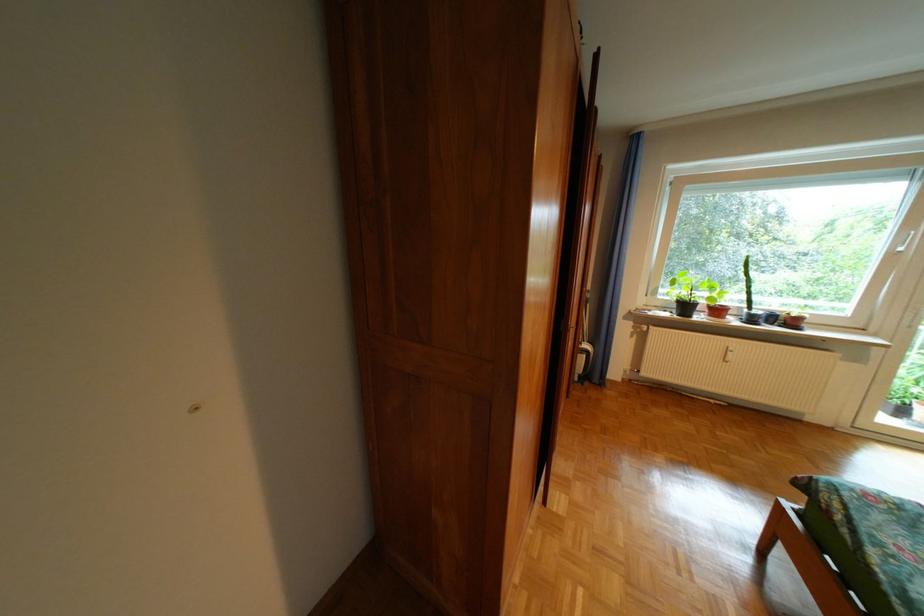
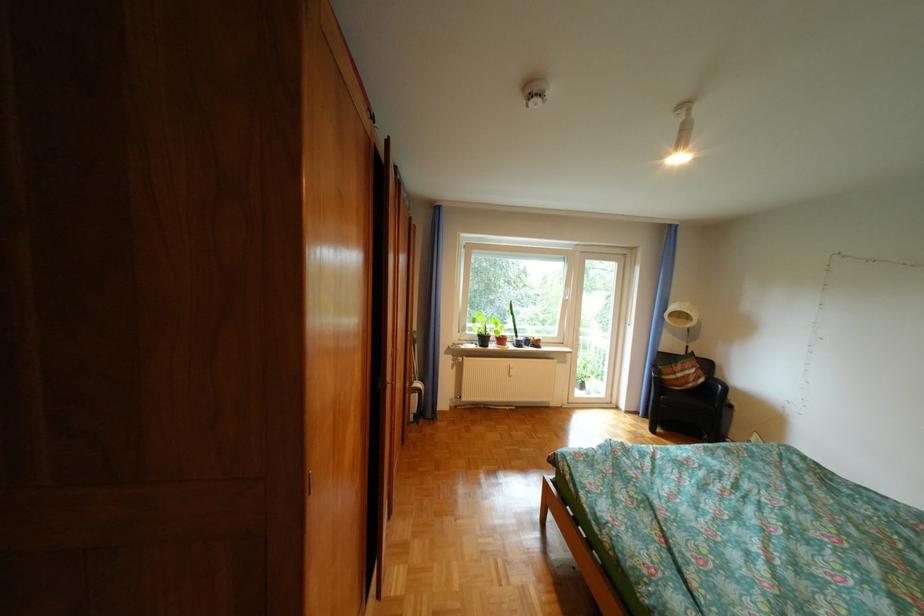
Question: The camera is either moving clockwise (left) or counter-clockwise (right) around the object. The first image is from the beginning of the video and the second image is from the end. Is the camera moving left or right when shooting the video?

Choices:
 (A) Left
 (B) Right

Answer: (A)